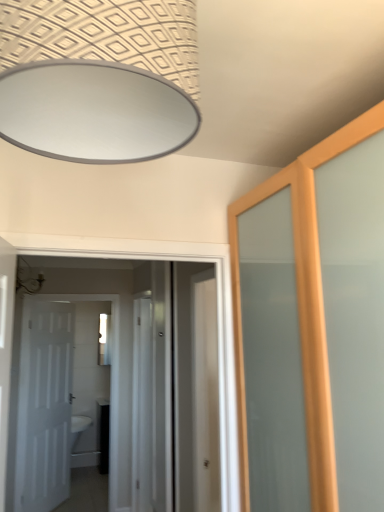
At what (x,y) coordinates should I click in order to perform the action: click on vacant region above white glossy door at center, acting as the 2th door starting from the back (from a real-world perspective). Please return your answer as a coordinate pair (x, y). The width and height of the screenshot is (384, 512). Looking at the image, I should click on (130, 237).